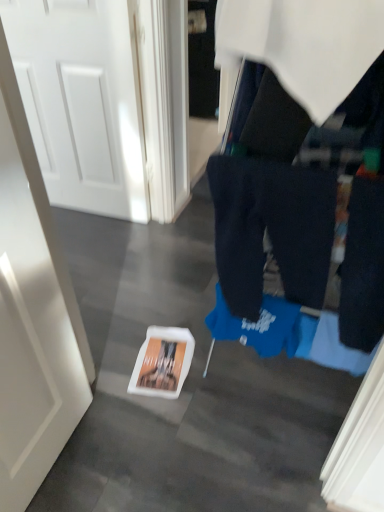
Question: Does blue fabric at center have a greater width compared to white glossy door at left, the first door ordered from the bottom?

Choices:
 (A) yes
 (B) no

Answer: (A)

Question: Is blue fabric at center positioned in front of white glossy door at left, marked as the 2th door in a back-to-front arrangement?

Choices:
 (A) no
 (B) yes

Answer: (A)

Question: Considering the relative sizes of blue fabric at center and white glossy door at left, marked as the 2th door in a back-to-front arrangement, in the image provided, is blue fabric at center shorter than white glossy door at left, marked as the 2th door in a back-to-front arrangement,?

Choices:
 (A) yes
 (B) no

Answer: (B)

Question: Is blue fabric at center behind white glossy door at left, the 2th door positioned from the top?

Choices:
 (A) no
 (B) yes

Answer: (B)

Question: Is blue fabric at center aimed at white glossy door at left, the 2th door positioned from the top?

Choices:
 (A) no
 (B) yes

Answer: (A)

Question: Based on their sizes in the image, would you say blue fabric at center is bigger or smaller than white glossy door at left, marked as the 2th door in a back-to-front arrangement?

Choices:
 (A) small
 (B) big

Answer: (B)

Question: Is point (380, 82) positioned closer to the camera than point (16, 280)?

Choices:
 (A) farther
 (B) closer

Answer: (B)

Question: Considering the positions of blue fabric at center and white glossy door at left, the 2th door positioned from the top, in the image, is blue fabric at center taller or shorter than white glossy door at left, the 2th door positioned from the top,?

Choices:
 (A) short
 (B) tall

Answer: (B)

Question: Considering the positions of blue fabric at center and white glossy door at left, the 2th door positioned from the top, in the image, is blue fabric at center wider or thinner than white glossy door at left, the 2th door positioned from the top,?

Choices:
 (A) wide
 (B) thin

Answer: (A)

Question: Visually, is white glossy door at left, marked as the 2th door in a back-to-front arrangement, positioned to the left or to the right of white glossy door at upper left, which is the second door from bottom to top?

Choices:
 (A) left
 (B) right

Answer: (B)

Question: In terms of size, does white glossy door at left, the first door when ordered from front to back, appear bigger or smaller than white glossy door at upper left, the first door when ordered from top to bottom?

Choices:
 (A) big
 (B) small

Answer: (B)

Question: Considering the positions of white glossy door at left, the first door when ordered from front to back, and white glossy door at upper left, arranged as the second door when viewed from the front, in the image, is white glossy door at left, the first door when ordered from front to back, taller or shorter than white glossy door at upper left, arranged as the second door when viewed from the front,?

Choices:
 (A) tall
 (B) short

Answer: (A)

Question: From a real-world perspective, is white glossy door at left, the first door ordered from the bottom, physically located above or below white glossy door at upper left, the first door when ordered from top to bottom?

Choices:
 (A) below
 (B) above

Answer: (B)

Question: Considering their positions, is dark blue cotton trousers at center located in front of or behind white glossy door at left, the 2th door positioned from the top?

Choices:
 (A) behind
 (B) front

Answer: (A)

Question: From a real-world perspective, is dark blue cotton trousers at center physically located above or below white glossy door at left, the 2th door positioned from the top?

Choices:
 (A) above
 (B) below

Answer: (A)